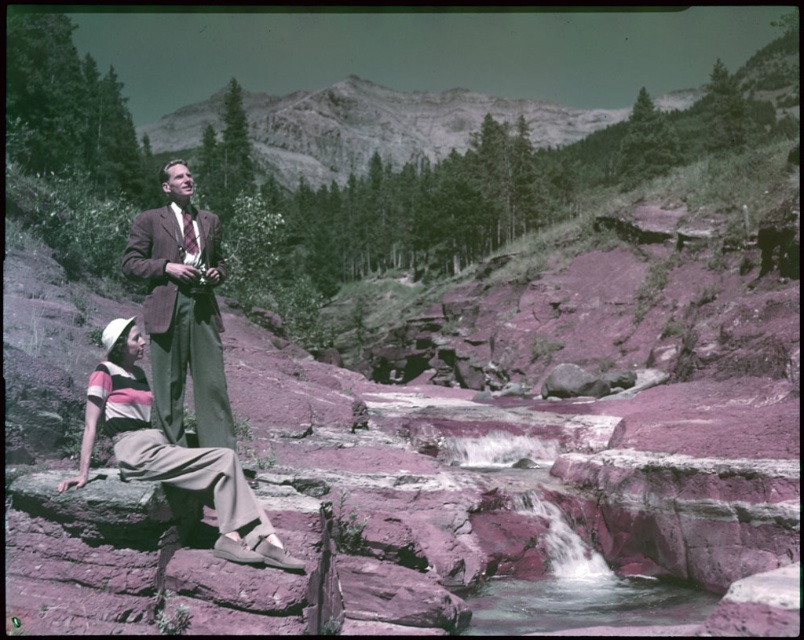
Question: Which object appears farthest from the camera in this image?

Choices:
 (A) matte brown suit at center
 (B) striped cotton shirt at lower left

Answer: (A)

Question: Among these objects, which one is nearest to the camera?

Choices:
 (A) matte brown suit at center
 (B) striped cotton shirt at lower left

Answer: (B)

Question: In this image, where is matte brown suit at center located relative to striped cotton shirt at lower left?

Choices:
 (A) above
 (B) below

Answer: (A)

Question: Considering the relative positions of matte brown suit at center and striped cotton shirt at lower left in the image provided, where is matte brown suit at center located with respect to striped cotton shirt at lower left?

Choices:
 (A) above
 (B) below

Answer: (A)

Question: Does matte brown suit at center come behind striped cotton shirt at lower left?

Choices:
 (A) yes
 (B) no

Answer: (A)